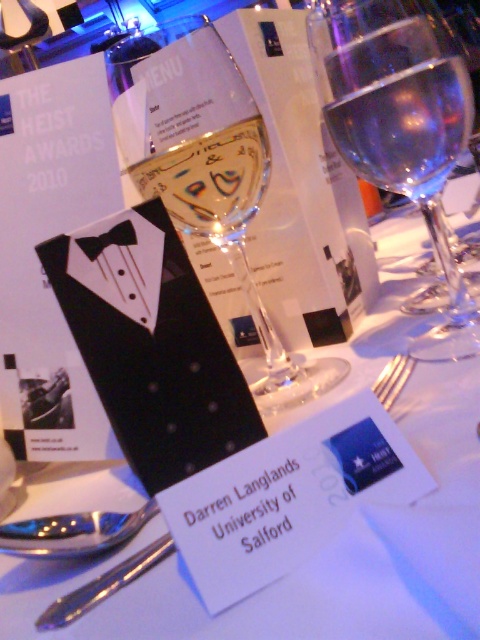
Question: Is clear glass wine at upper right above black satin bow tie at center?

Choices:
 (A) no
 (B) yes

Answer: (B)

Question: Is clear glass wine at upper right closer to camera compared to silver metallic fork at center?

Choices:
 (A) no
 (B) yes

Answer: (B)

Question: Does transparent glass wine glass at center appear under transparent glass at center?

Choices:
 (A) no
 (B) yes

Answer: (B)

Question: Which is nearer to the transparent glass wine glass at upper center?

Choices:
 (A) transparent glass at center
 (B) clear glass wine at upper right
 (C) transparent glass wine glass at center
 (D) silver metallic fork at center

Answer: (B)

Question: Which point is closer to the camera?

Choices:
 (A) (250, 285)
 (B) (137, 563)
 (C) (251, 177)

Answer: (B)

Question: Among these objects, which one is nearest to the camera?

Choices:
 (A) transparent glass wine glass at center
 (B) black satin bow tie at center

Answer: (B)